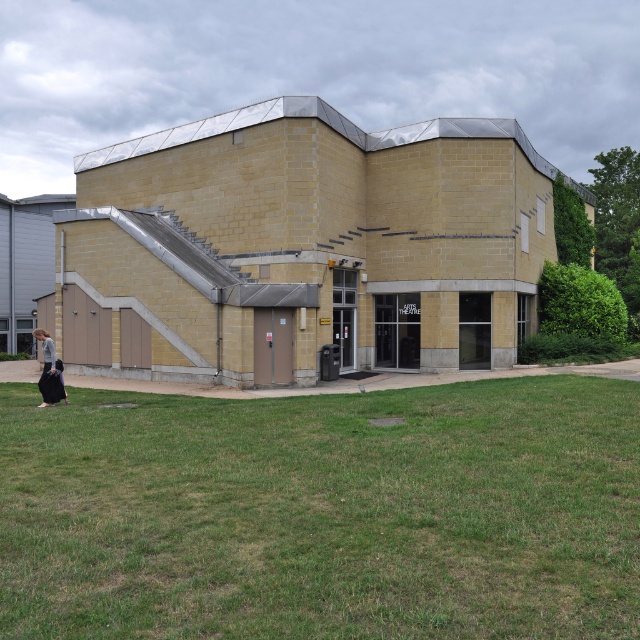
Question: Which of the following is the closest to the observer?

Choices:
 (A) (60, 400)
 (B) (44, 400)

Answer: (B)

Question: Is green grass at lower center to the left of black fabric bag at lower left from the viewer's perspective?

Choices:
 (A) yes
 (B) no

Answer: (B)

Question: Which point appears closest to the camera in this image?

Choices:
 (A) (54, 397)
 (B) (40, 374)

Answer: (A)

Question: Is green grass at lower center above black fabric bag at lower left?

Choices:
 (A) yes
 (B) no

Answer: (B)

Question: Does green grass at lower center appear under black fabric bag at lower left?

Choices:
 (A) yes
 (B) no

Answer: (A)

Question: Which point is farther from the camera taking this photo?

Choices:
 (A) [x=52, y=376]
 (B) [x=289, y=560]

Answer: (A)